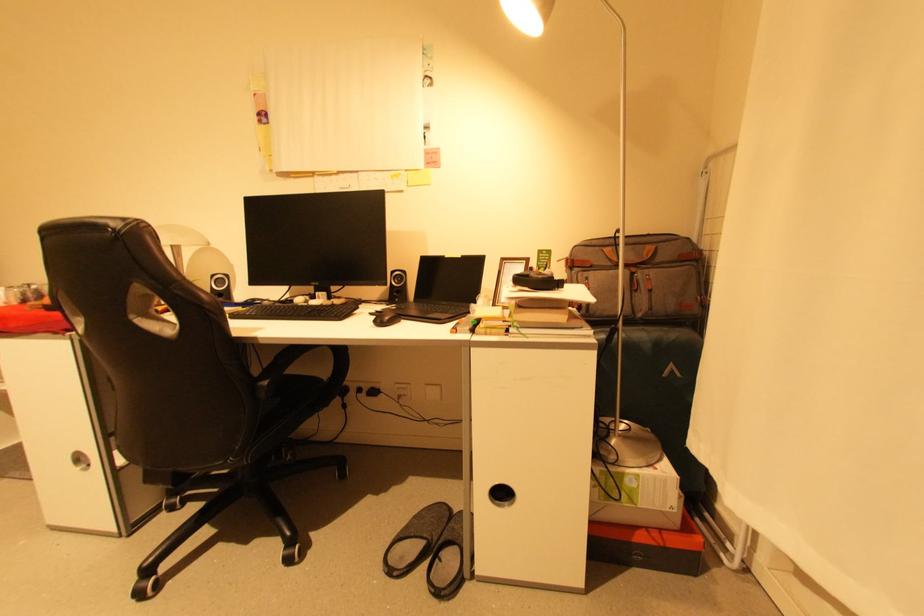
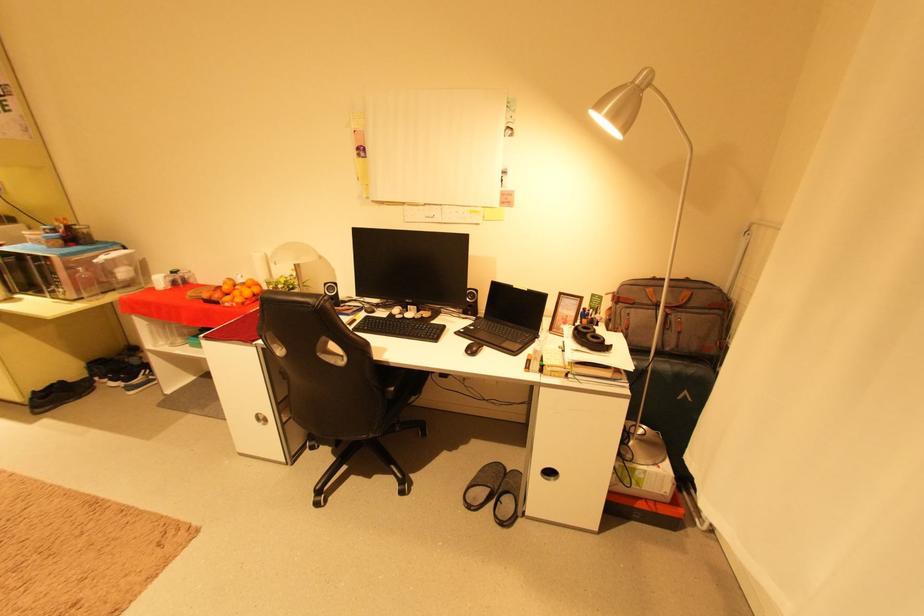
Find the pixel in the second image that matches (x=220, y=277) in the first image.

(333, 285)